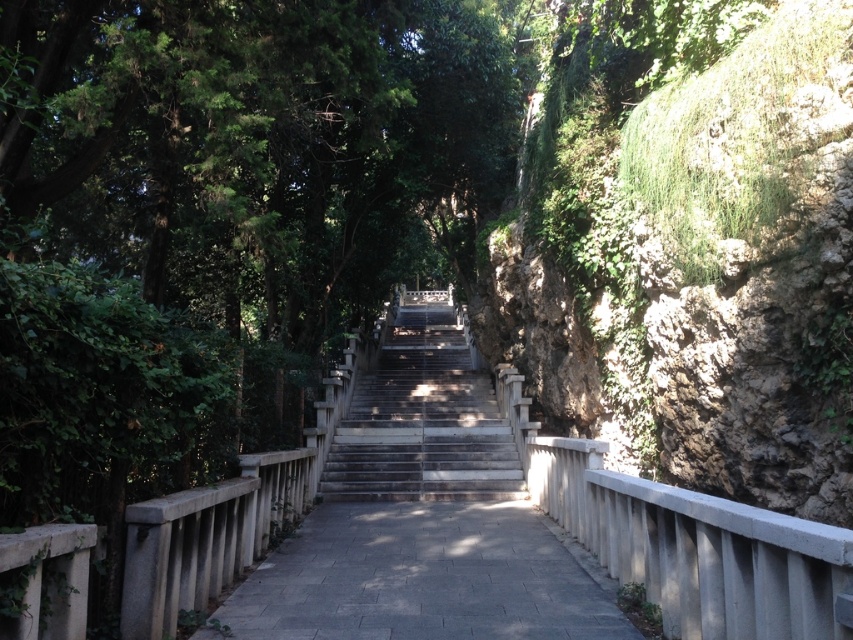
Can you confirm if green mossy rock at right is bigger than gray concrete path at center?

Yes, green mossy rock at right is bigger than gray concrete path at center.

What do you see at coordinates (691, 262) in the screenshot? Image resolution: width=853 pixels, height=640 pixels. I see `green mossy rock at right` at bounding box center [691, 262].

What do you see at coordinates (691, 262) in the screenshot?
I see `green mossy rock at right` at bounding box center [691, 262].

Identify the location of green mossy rock at right. (691, 262).

Does green leafy tree at center have a greater width compared to gray concrete path at center?

Yes, green leafy tree at center is wider than gray concrete path at center.

Is green leafy tree at center below gray concrete path at center?

Incorrect, green leafy tree at center is not positioned below gray concrete path at center.

Identify the location of green leafy tree at center. (221, 220).

Which is above, gray concrete path at center or gray concrete stairs at center?

gray concrete stairs at center is higher up.

Does gray concrete path at center have a greater width compared to gray concrete stairs at center?

Correct, the width of gray concrete path at center exceeds that of gray concrete stairs at center.

Locate an element on the screen. gray concrete path at center is located at coordinates tap(422, 522).

Where is `gray concrete path at center`? gray concrete path at center is located at coordinates (422, 522).